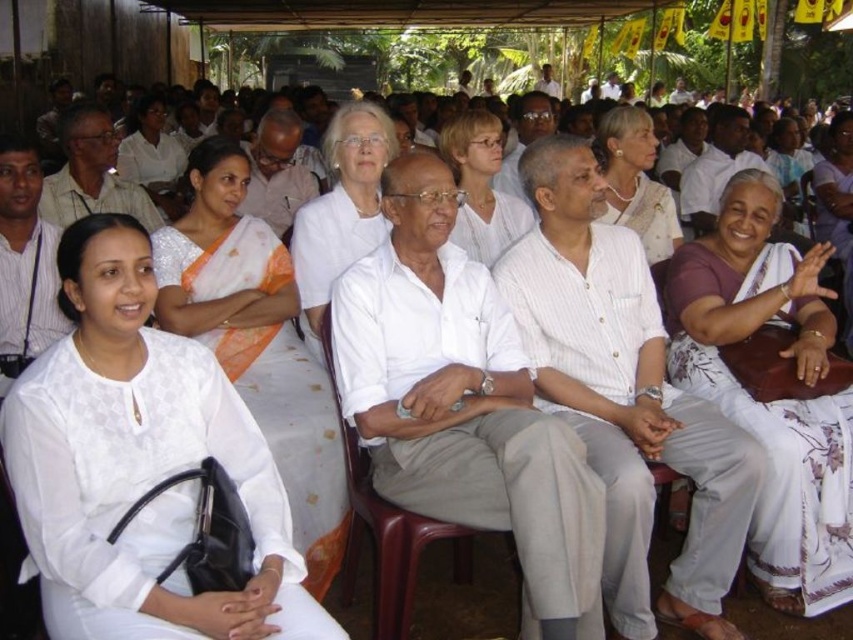
Question: Which of the following is the farthest from the observer?

Choices:
 (A) (376, 211)
 (B) (633, 323)
 (C) (618, 195)

Answer: (C)

Question: Which of the following is the farthest from the observer?

Choices:
 (A) (738, 413)
 (B) (404, 582)
 (C) (654, 141)
 (D) (624, 362)

Answer: (C)

Question: Is white cotton saree at center further to the viewer compared to purple floral sari at center?

Choices:
 (A) yes
 (B) no

Answer: (B)

Question: In this image, where is purple floral sari at center located relative to light brown hair at center?

Choices:
 (A) right
 (B) left

Answer: (A)

Question: Is white cotton saree at center closer to the viewer compared to purple floral sari at center?

Choices:
 (A) yes
 (B) no

Answer: (A)

Question: Which of these objects is positioned closest to the light brown hair at center?

Choices:
 (A) purple floral sari at center
 (B) white silk saree at center
 (C) plastic chair at center
 (D) white matte blouse at left

Answer: (B)